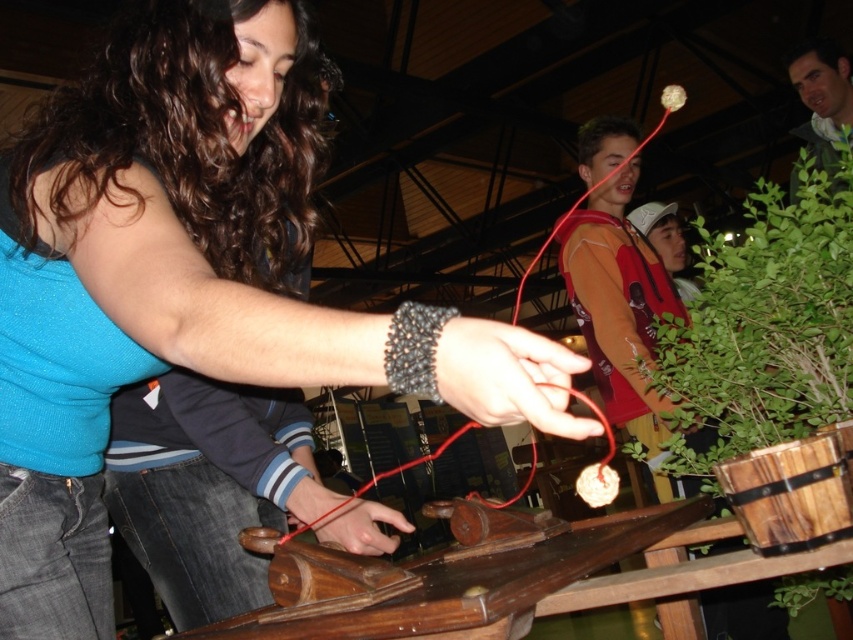
Is point (61, 296) positioned behind point (759, 378)?

No, (61, 296) is in front of (759, 378).

Does matte blue shirt at center have a larger size compared to green leafy plant at right?

Incorrect, matte blue shirt at center is not larger than green leafy plant at right.

What are the coordinates of `matte blue shirt at center` in the screenshot? It's located at (189, 282).

Where is `matte blue shirt at center`? This screenshot has height=640, width=853. matte blue shirt at center is located at coordinates (189, 282).